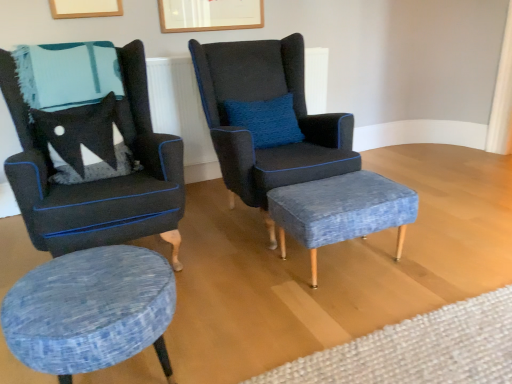
Question: Considering the relative sizes of textured blue fabric stool at lower left, the second stool viewed from the right, and blue textured ottoman at center, which appears as the 1th plain when viewed from the front, in the image provided, is textured blue fabric stool at lower left, the second stool viewed from the right, smaller than blue textured ottoman at center, which appears as the 1th plain when viewed from the front,?

Choices:
 (A) yes
 (B) no

Answer: (A)

Question: From the image's perspective, does textured blue fabric stool at lower left, arranged as the 2th stool when viewed from the back, appear lower than blue textured ottoman at center, which appears as the 1th plain when viewed from the front?

Choices:
 (A) no
 (B) yes

Answer: (B)

Question: Is the position of textured blue fabric stool at lower left, the second stool viewed from the right, less distant than that of blue textured ottoman at center, the second plain from the back?

Choices:
 (A) yes
 (B) no

Answer: (B)

Question: Does textured blue fabric stool at lower left, positioned as the first stool in left-to-right order, appear on the left side of blue textured ottoman at center, the second plain from the back?

Choices:
 (A) no
 (B) yes

Answer: (B)

Question: Is textured blue fabric stool at lower left, placed as the 1th stool when sorted from front to back, not near blue textured ottoman at center, the second plain from the back?

Choices:
 (A) no
 (B) yes

Answer: (A)

Question: Relative to blue textured ottoman at center, the second plain from the back, is velvet dark blue armchair at center, the 2th chair when ordered from left to right, in front or behind?

Choices:
 (A) behind
 (B) front

Answer: (A)

Question: From the image's perspective, is velvet dark blue armchair at center, placed as the 1th chair when sorted from right to left, positioned above or below blue textured ottoman at center, which appears as the 1th plain when viewed from the front?

Choices:
 (A) below
 (B) above

Answer: (B)

Question: Do you think velvet dark blue armchair at center, placed as the 1th chair when sorted from right to left, is within blue textured ottoman at center, the second plain from the back, or outside of it?

Choices:
 (A) outside
 (B) inside

Answer: (A)

Question: Considering the positions of velvet dark blue armchair at center, placed as the 1th chair when sorted from right to left, and blue textured ottoman at center, the second plain from the back, in the image, is velvet dark blue armchair at center, placed as the 1th chair when sorted from right to left, bigger or smaller than blue textured ottoman at center, the second plain from the back,?

Choices:
 (A) small
 (B) big

Answer: (B)

Question: Is white textured rug at lower right, marked as the 1th plain in a back-to-front arrangement, inside or outside of blue textured ottoman at center, the second plain from the back?

Choices:
 (A) inside
 (B) outside

Answer: (A)

Question: Looking at the image, does white textured rug at lower right, the 2th plain positioned from the front, seem bigger or smaller compared to blue textured ottoman at center, the second plain from the back?

Choices:
 (A) small
 (B) big

Answer: (A)

Question: Is white textured rug at lower right, marked as the 1th plain in a back-to-front arrangement, to the left or to the right of blue textured ottoman at center, which appears as the 1th plain when viewed from the front, in the image?

Choices:
 (A) right
 (B) left

Answer: (B)

Question: In terms of height, does white textured rug at lower right, marked as the 1th plain in a back-to-front arrangement, look taller or shorter compared to blue textured ottoman at center, which appears as the 1th plain when viewed from the front?

Choices:
 (A) short
 (B) tall

Answer: (B)

Question: Is blue textured ottoman at center, which appears as the 1th plain when viewed from the front, taller or shorter than white textured rug at lower right, marked as the 1th plain in a back-to-front arrangement?

Choices:
 (A) tall
 (B) short

Answer: (B)

Question: Is blue textured ottoman at center, which appears as the 1th plain when viewed from the front, to the left or to the right of white textured rug at lower right, the 2th plain positioned from the front, in the image?

Choices:
 (A) left
 (B) right

Answer: (B)